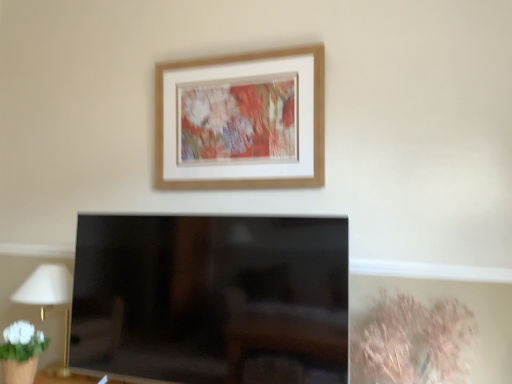
Question: From their relative heights in the image, would you say white fabric lampshade at left is taller or shorter than wooden picture frame at upper center?

Choices:
 (A) short
 (B) tall

Answer: (A)

Question: Is white fabric lampshade at left in front of or behind wooden picture frame at upper center in the image?

Choices:
 (A) behind
 (B) front

Answer: (A)

Question: Which object is positioned farthest from the white fabric lampshade at left?

Choices:
 (A) dry grass at lower right
 (B) wooden picture frame at upper center

Answer: (A)

Question: Based on their relative distances, which object is farther from the dry grass at lower right?

Choices:
 (A) white fabric lampshade at left
 (B) wooden picture frame at upper center

Answer: (A)